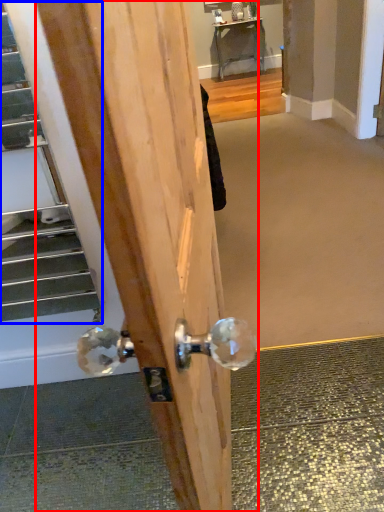
Question: Which of the following is the farthest to the observer, door (highlighted by a red box) or escalator (highlighted by a blue box)?

Choices:
 (A) door
 (B) escalator

Answer: (B)